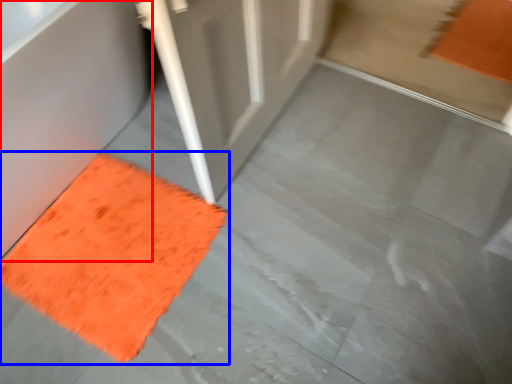
Question: Which object appears farthest to the camera in this image, bath (highlighted by a red box) or mat (highlighted by a blue box)?

Choices:
 (A) bath
 (B) mat

Answer: (B)